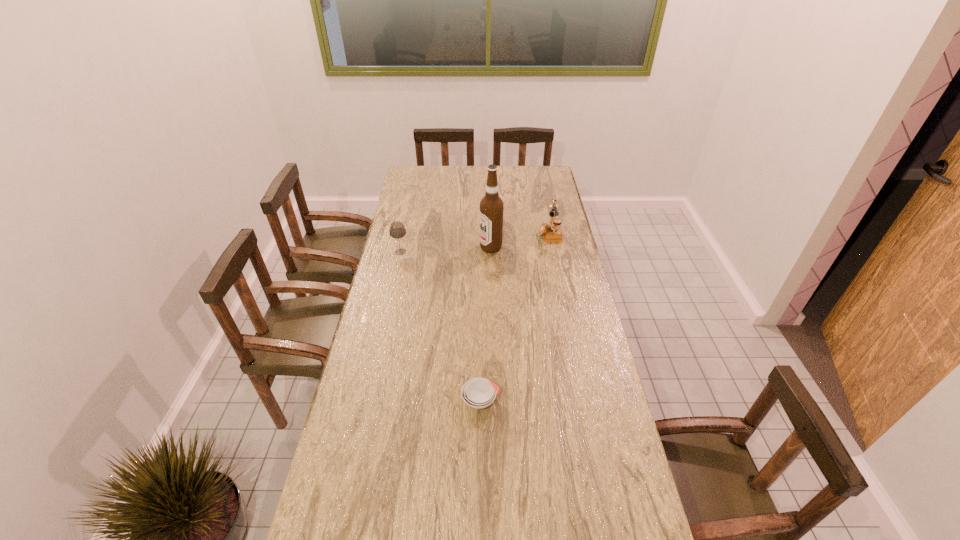
Where is `blank space located on the dial number of the rightmost object`? Image resolution: width=960 pixels, height=540 pixels. blank space located on the dial number of the rightmost object is located at coordinates (517, 233).

Locate an element on the screen. Image resolution: width=960 pixels, height=540 pixels. free space located on the front of the leftmost object is located at coordinates (395, 281).

Locate an element on the screen. The height and width of the screenshot is (540, 960). free space located on the back of the soup bowl is located at coordinates (480, 348).

What are the coordinates of `object at the left edge` in the screenshot? It's located at (397, 230).

Find the location of `object present at the right edge`. object present at the right edge is located at coordinates (552, 232).

The width and height of the screenshot is (960, 540). What are the coordinates of `free spot at the far edge of the desktop` in the screenshot? It's located at (450, 186).

Where is `vacant space at the left edge`? The width and height of the screenshot is (960, 540). vacant space at the left edge is located at coordinates (413, 318).

The width and height of the screenshot is (960, 540). Find the location of `vacant space at the right edge of the desktop`. vacant space at the right edge of the desktop is located at coordinates (572, 259).

Where is `vacant point located between the nearest object and the wineglass`? vacant point located between the nearest object and the wineglass is located at coordinates 441,326.

You are a GUI agent. You are given a task and a screenshot of the screen. Output one action in this format:
    pyautogui.click(x=<x>, y=<y>)
    Task: Click on the vacant region between the wineglass and the telephone
    The height and width of the screenshot is (540, 960).
    Given the screenshot: What is the action you would take?
    pyautogui.click(x=475, y=242)